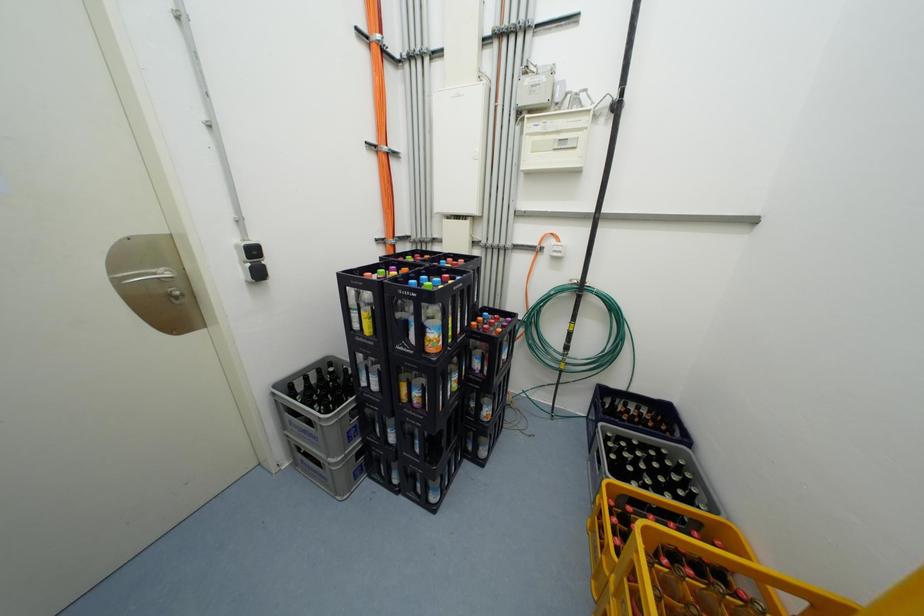
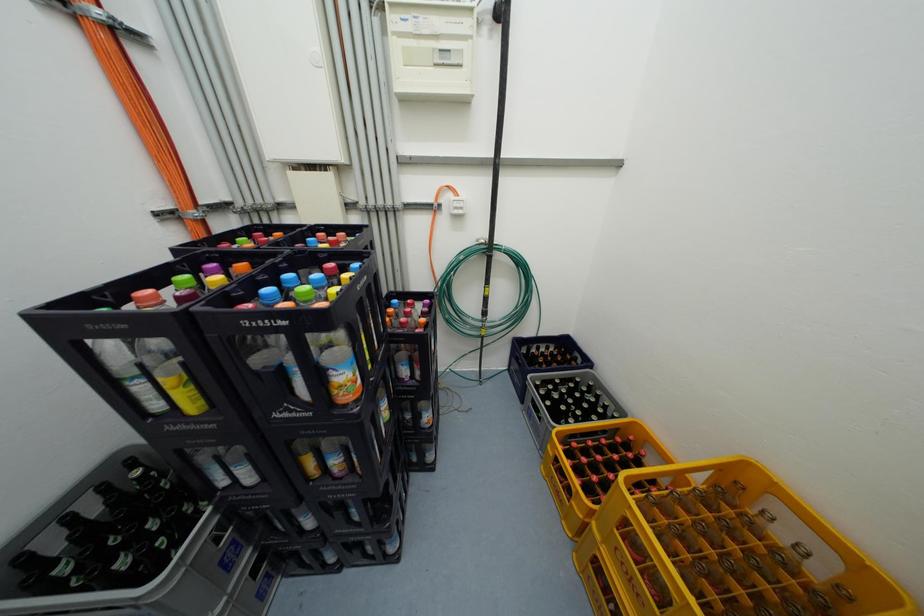
Question: The camera is either moving clockwise (left) or counter-clockwise (right) around the object. The first image is from the beginning of the video and the second image is from the end. Is the camera moving left or right when shooting the video?

Choices:
 (A) Left
 (B) Right

Answer: (A)